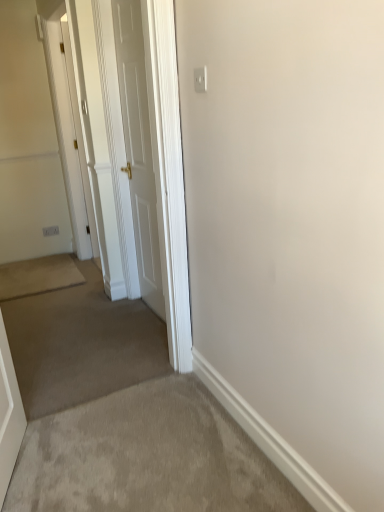
Question: Can you confirm if white glossy door at center, the 1th door from the front, is taller than white glossy door at upper left, acting as the 2th door starting from the right?

Choices:
 (A) yes
 (B) no

Answer: (B)

Question: From the image's perspective, is white glossy door at center, the 1th door from the front, beneath white glossy door at upper left, the 1th door in the back-to-front sequence?

Choices:
 (A) no
 (B) yes

Answer: (B)

Question: Does white glossy door at center, marked as the first door in a right-to-left arrangement, appear on the right side of white glossy door at upper left, acting as the 2th door starting from the right?

Choices:
 (A) yes
 (B) no

Answer: (A)

Question: Is white glossy door at center, which ranks as the second door in left-to-right order, thinner than white glossy door at upper left, which appears as the 1th door when viewed from the left?

Choices:
 (A) no
 (B) yes

Answer: (A)

Question: From a real-world perspective, does white glossy door at center, the 1th door from the front, stand above white glossy door at upper left, which appears as the 1th door when viewed from the left?

Choices:
 (A) no
 (B) yes

Answer: (A)

Question: Is white glossy door at upper left, acting as the 2th door starting from the right, directly adjacent to white glossy door at center, marked as the first door in a right-to-left arrangement?

Choices:
 (A) no
 (B) yes

Answer: (A)

Question: From a real-world perspective, is white glossy door at upper left, acting as the 2th door starting from the right, physically above white glossy door at center, marked as the first door in a right-to-left arrangement?

Choices:
 (A) yes
 (B) no

Answer: (A)

Question: Is white glossy door at upper left, acting as the 2th door starting from the right, further to camera compared to white glossy door at center, the 1th door from the front?

Choices:
 (A) yes
 (B) no

Answer: (A)

Question: Does white glossy door at upper left, acting as the 2th door starting from the right, have a greater width compared to white glossy door at center, which ranks as the second door in left-to-right order?

Choices:
 (A) yes
 (B) no

Answer: (B)

Question: Does white glossy door at upper left, the 1th door in the back-to-front sequence, have a smaller size compared to white glossy door at center, which ranks as the second door in left-to-right order?

Choices:
 (A) no
 (B) yes

Answer: (B)

Question: Is white glossy door at upper left, the 1th door in the back-to-front sequence, facing towards white glossy door at center, the 2th door from the back?

Choices:
 (A) yes
 (B) no

Answer: (A)

Question: Considering the positions of white glossy door at center, which ranks as the second door in left-to-right order, and white glossy door at upper left, acting as the 2th door starting from the right, in the image, is white glossy door at center, which ranks as the second door in left-to-right order, wider or thinner than white glossy door at upper left, acting as the 2th door starting from the right,?

Choices:
 (A) wide
 (B) thin

Answer: (A)